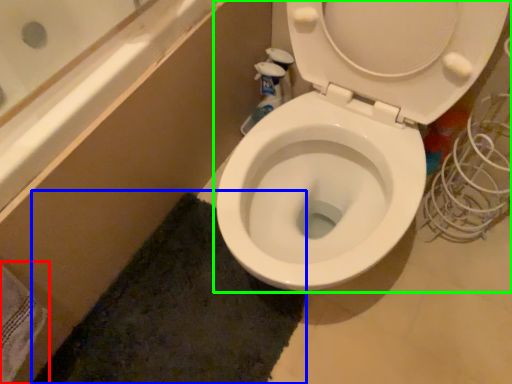
Question: Which is farther away from bath towel (highlighted by a red box)? bath mat (highlighted by a blue box) or toilet (highlighted by a green box)?

Choices:
 (A) bath mat
 (B) toilet

Answer: (B)